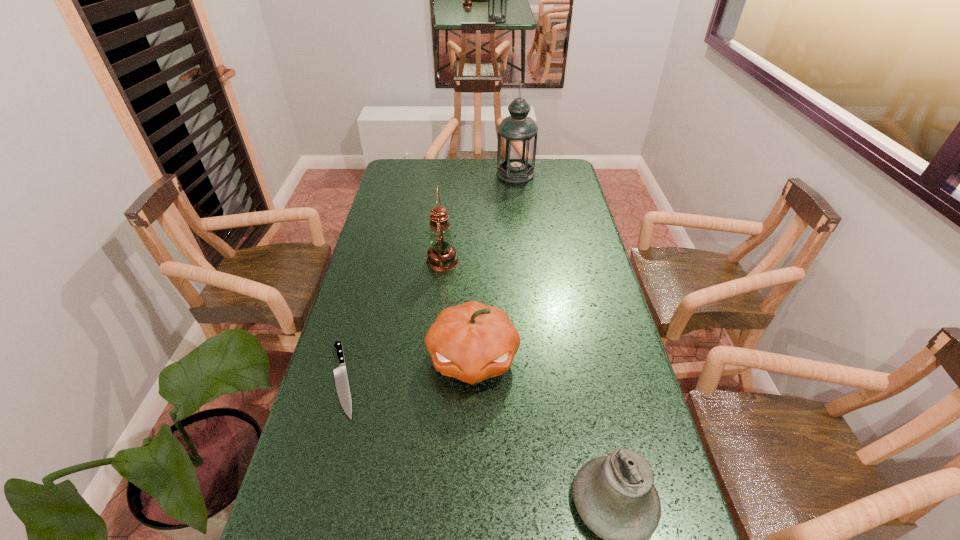
Locate an element on the screen. The image size is (960, 540). free space between the nearer oil lamp and the right oil lamp is located at coordinates (479, 218).

The width and height of the screenshot is (960, 540). Identify the location of free space between the pumpkin and the steak knife. (408, 369).

Identify the location of vacant area that lies between the steak knife and the shorter oil lamp. This screenshot has width=960, height=540. (393, 320).

I want to click on object that stands as the second closest to the farther oil lamp, so click(x=472, y=342).

Where is `object that stands as the fourth closest to the bell`? This screenshot has height=540, width=960. object that stands as the fourth closest to the bell is located at coordinates (517, 134).

Find the location of a particular element. The image size is (960, 540). vacant position in the image that satisfies the following two spatial constraints: 1. on the back side of the farther oil lamp; 2. on the left side of the shortest object is located at coordinates [x=399, y=174].